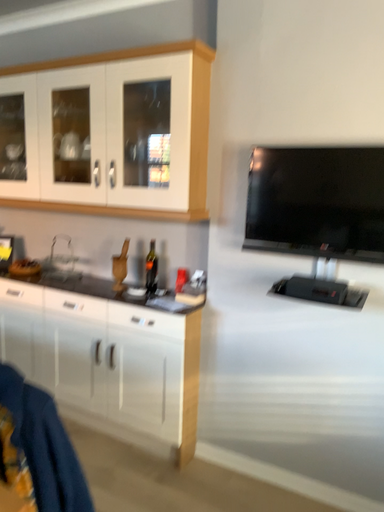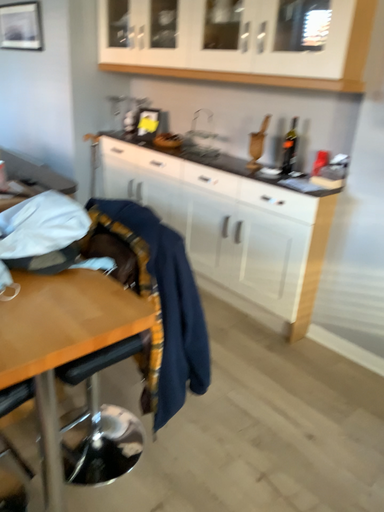
Question: How did the camera likely rotate when shooting the video?

Choices:
 (A) rotated left
 (B) rotated right

Answer: (A)